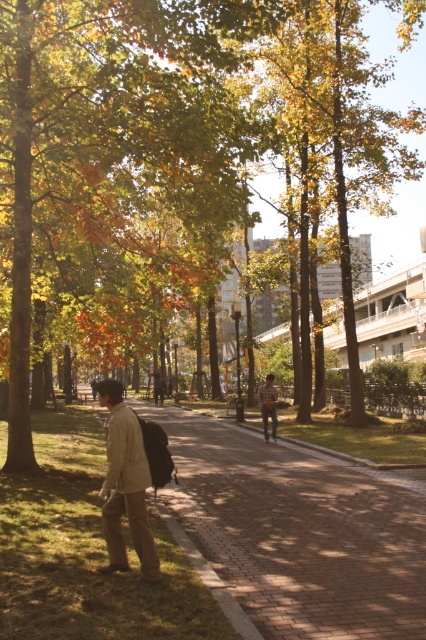
Is green leafy tree at center wider than khaki cotton jacket at left?

Correct, the width of green leafy tree at center exceeds that of khaki cotton jacket at left.

Is green leafy tree at center thinner than khaki cotton jacket at left?

Incorrect, green leafy tree at center's width is not less than khaki cotton jacket at left's.

The height and width of the screenshot is (640, 426). I want to click on green leafy tree at center, so click(123, 156).

I want to click on green leafy tree at center, so click(x=123, y=156).

Does green leafy tree at center appear under plaid shirt at center?

No.

Who is more forward, (382, 172) or (264, 440)?

Point (264, 440) is more forward.

Does point (167, 300) lie in front of point (262, 392)?

Yes.

The width and height of the screenshot is (426, 640). Find the location of `green leafy tree at center`. green leafy tree at center is located at coordinates (123, 156).

Between khaki cotton jacket at left and plaid shirt at center, which one has less height?

khaki cotton jacket at left is shorter.

Does point (101, 384) come behind point (271, 378)?

No, (101, 384) is closer to viewer.

Identify the location of khaki cotton jacket at left. Image resolution: width=426 pixels, height=640 pixels. (124, 484).